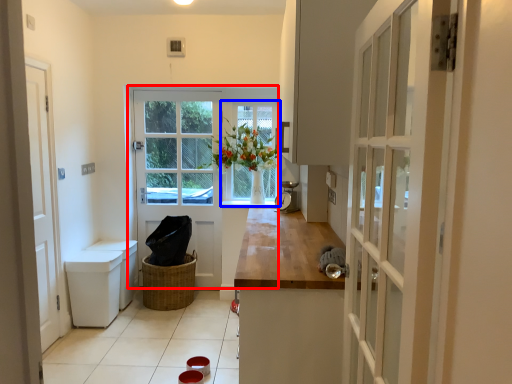
Question: Among these objects, which one is farthest to the camera, door (highlighted by a red box) or window (highlighted by a blue box)?

Choices:
 (A) door
 (B) window

Answer: (B)